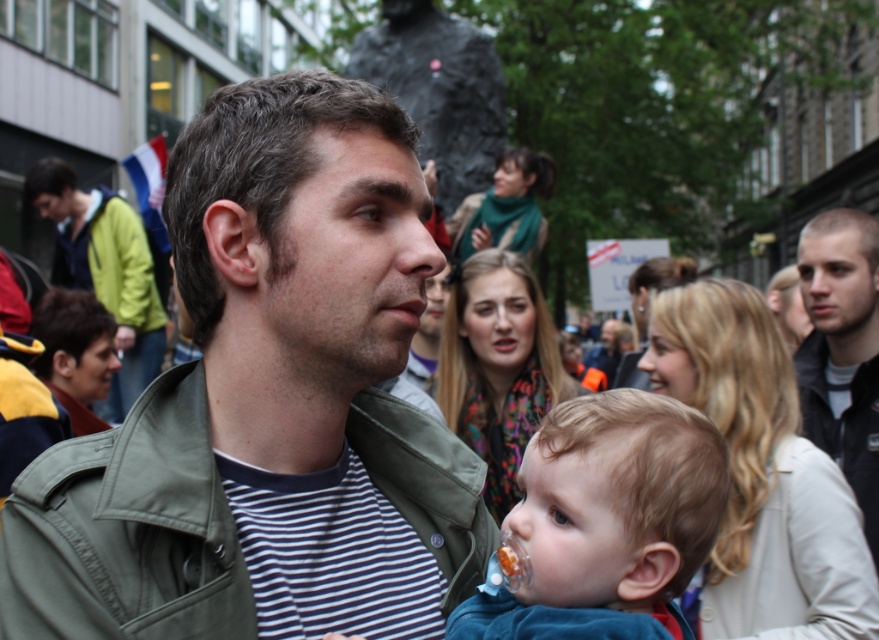
Question: Which object appears farthest from the camera in this image?

Choices:
 (A) dark gray jacket at right
 (B) green canvas jacket at center
 (C) green fabric jacket at left

Answer: (C)

Question: Does smooth blue shirt at center appear on the left side of green fabric jacket at left?

Choices:
 (A) yes
 (B) no

Answer: (B)

Question: Can you confirm if green matte jacket at center is bigger than green canvas jacket at center?

Choices:
 (A) no
 (B) yes

Answer: (B)

Question: Does green matte jacket at center appear on the left side of green fabric jacket at left?

Choices:
 (A) yes
 (B) no

Answer: (B)

Question: Which point is farther to the camera?

Choices:
 (A) click(294, 486)
 (B) click(478, 472)
 (C) click(93, 243)

Answer: (C)

Question: Among these objects, which one is farthest from the camera?

Choices:
 (A) dark gray jacket at right
 (B) green matte jacket at center

Answer: (A)